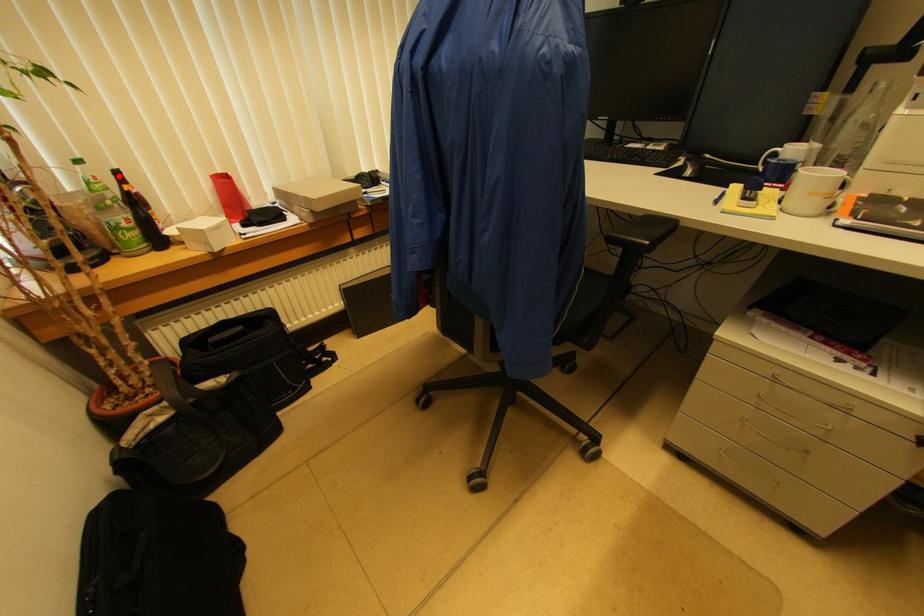
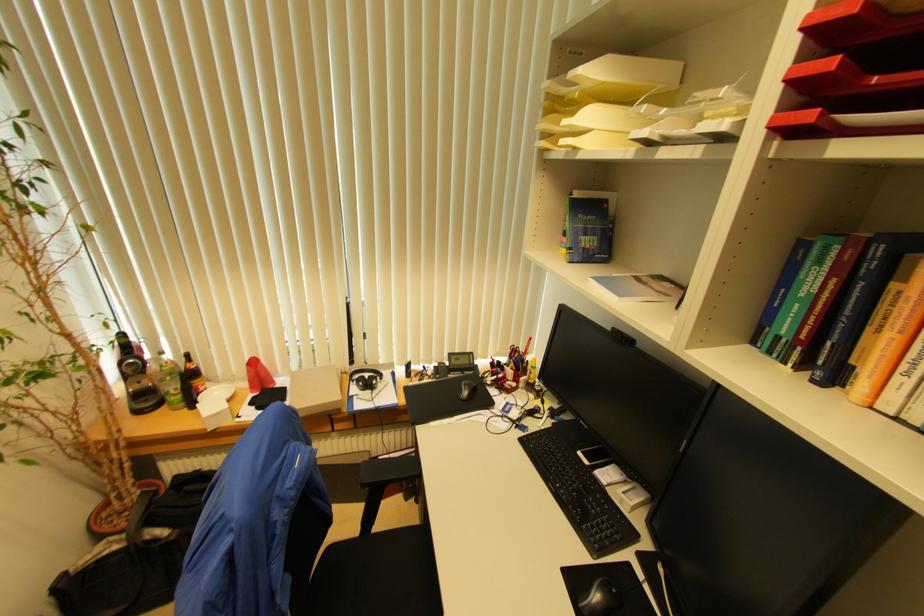
Locate, in the second image, the point that corresponds to the highlighted location in the first image.

(188, 358)